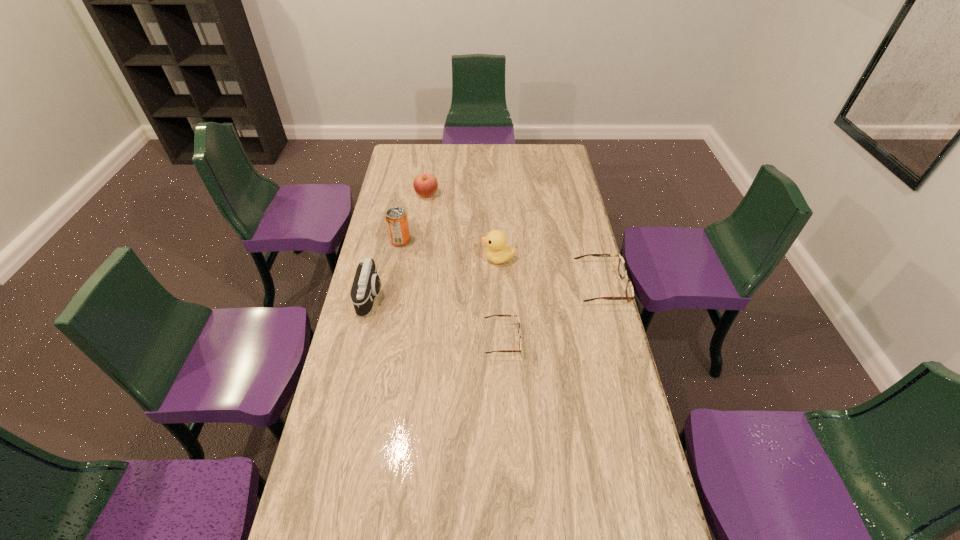
Where is `the nearest object`? the nearest object is located at coordinates (518, 322).

Identify the location of the shorter spectacles. (518, 322).

The width and height of the screenshot is (960, 540). I want to click on the farther spectacles, so click(622, 270).

The image size is (960, 540). I want to click on the fifth tallest object, so click(622, 270).

The height and width of the screenshot is (540, 960). I want to click on apple, so click(x=425, y=185).

Where is `the fourth tallest object`? This screenshot has height=540, width=960. the fourth tallest object is located at coordinates (425, 185).

Locate an element on the screen. The image size is (960, 540). the fifth nearest object is located at coordinates (397, 223).

You are a GUI agent. You are given a task and a screenshot of the screen. Output one action in this format:
    pyautogui.click(x=<x>, y=<y>)
    Task: Click on the camera
    This screenshot has width=960, height=540.
    Given the screenshot: What is the action you would take?
    pyautogui.click(x=366, y=285)

Where is `duck`? The height and width of the screenshot is (540, 960). duck is located at coordinates (497, 252).

Locate an element on the screen. This screenshot has width=960, height=540. free space located 0.100m on the frame of the shorter spectacles is located at coordinates (550, 340).